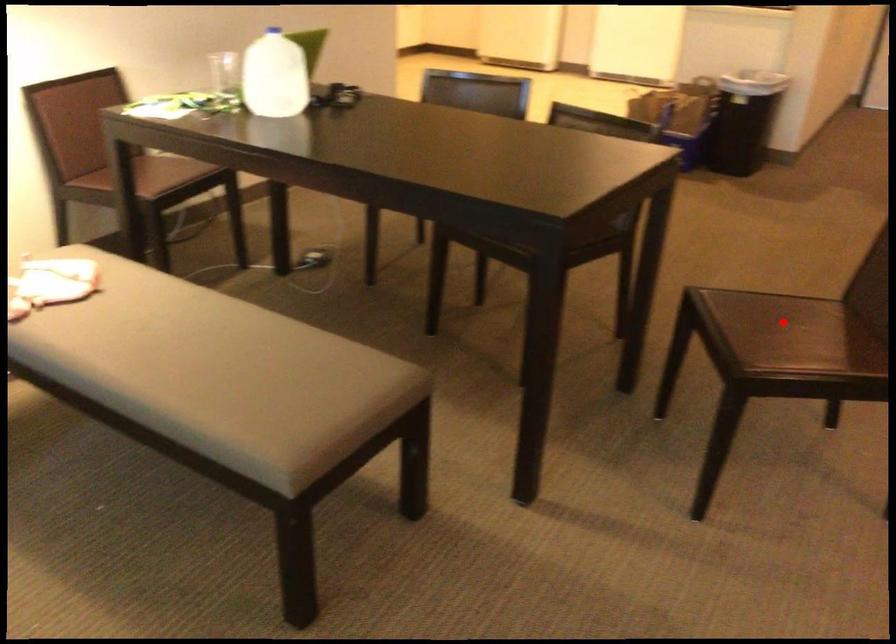
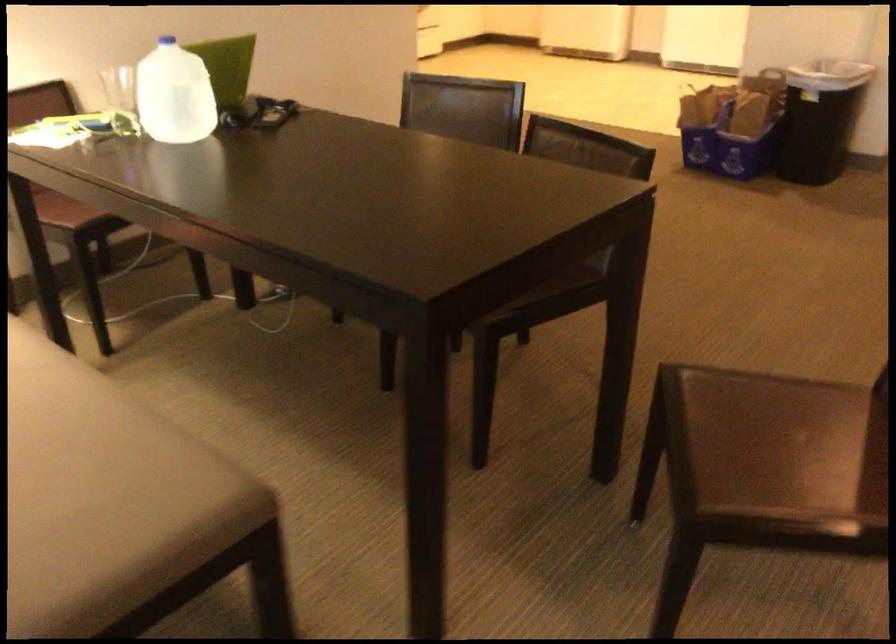
Question: I am providing you with two images of the same scene from different viewpoints. Given a red point in image1, look at the same physical point in image2. Is it:

Choices:
 (A) Closer to the viewpoint
 (B) Farther from the viewpoint

Answer: (A)